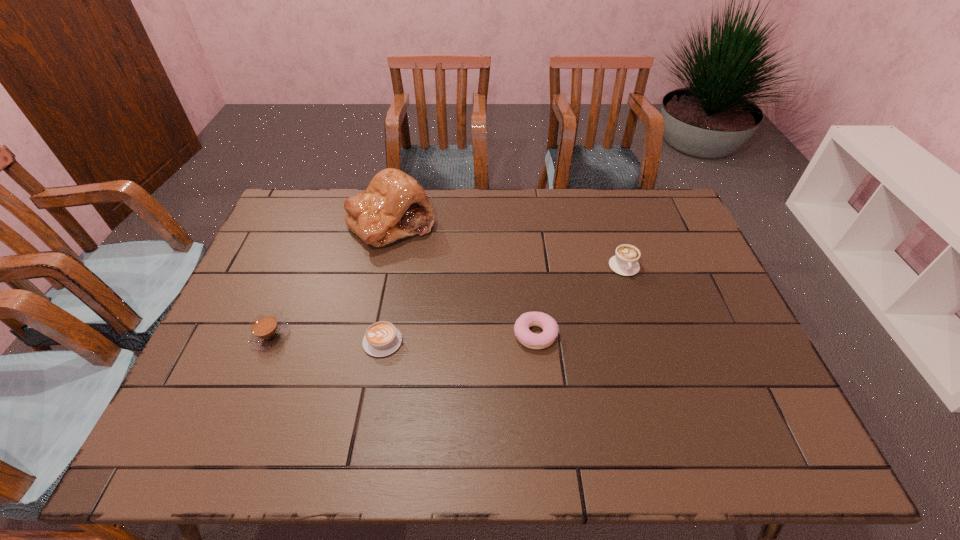
The image size is (960, 540). I want to click on the second closest object to the shortest object, so tap(394, 205).

Image resolution: width=960 pixels, height=540 pixels. I want to click on object that stands as the closest to the bread, so pos(266,331).

Locate an element on the screen. This screenshot has height=540, width=960. cappuccino that is the closest to the second cappuccino from left to right is located at coordinates (266, 331).

Find the location of a particular element. The image size is (960, 540). cappuccino that stands as the closest to the rightmost object is located at coordinates (382, 338).

At what (x,y) coordinates should I click in order to perform the action: click on free spot that satisfies the following two spatial constraints: 1. on the back side of the leftmost object; 2. on the left side of the second shortest object. Please return your answer as a coordinate pair (x, y). The height and width of the screenshot is (540, 960). Looking at the image, I should click on (271, 335).

At what (x,y) coordinates should I click in order to perform the action: click on free region that satisfies the following two spatial constraints: 1. on the filling side of the farthest object; 2. on the left side of the second object from right to left. Please return your answer as a coordinate pair (x, y). The image size is (960, 540). Looking at the image, I should click on (367, 335).

Identify the location of vacant space that satisfies the following two spatial constraints: 1. to the right of the farthest cappuccino's handle; 2. on the side of the second cappuccino from left to right with the handle. This screenshot has height=540, width=960. (648, 342).

Find the location of a particular element. This screenshot has width=960, height=540. vacant point that satisfies the following two spatial constraints: 1. on the filling side of the doughnut; 2. on the right side of the bread is located at coordinates (367, 335).

Find the location of a particular element. This screenshot has height=540, width=960. vacant position in the image that satisfies the following two spatial constraints: 1. to the right of the rightmost object's handle; 2. on the side of the second cappuccino from right to left with the handle is located at coordinates (648, 342).